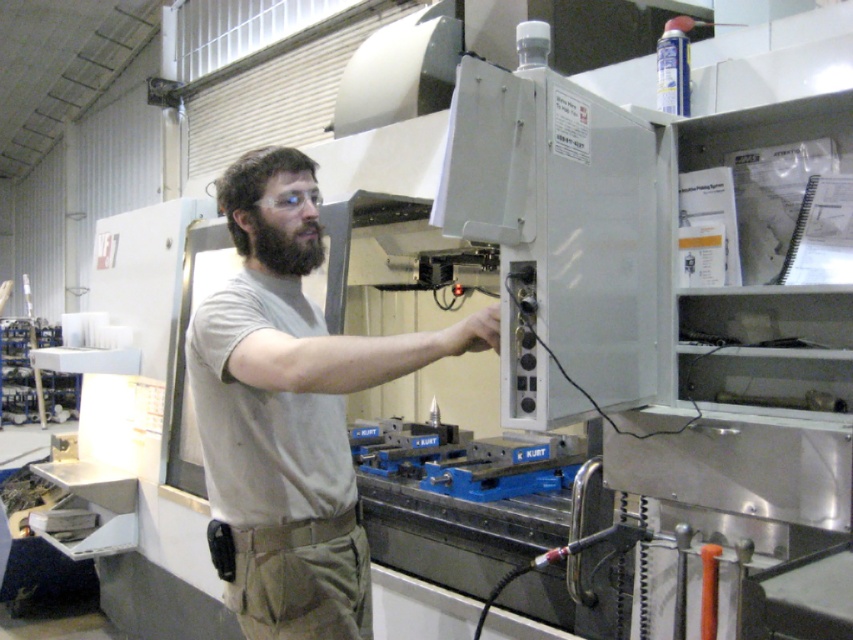
Question: Is light gray shirt at center below black fuzzy beard at center?

Choices:
 (A) yes
 (B) no

Answer: (A)

Question: Which object appears farthest from the camera in this image?

Choices:
 (A) black fuzzy beard at center
 (B) light gray shirt at center

Answer: (A)

Question: Where is light gray shirt at center located in relation to black fuzzy beard at center in the image?

Choices:
 (A) left
 (B) right

Answer: (B)

Question: Which point appears farthest from the camera in this image?

Choices:
 (A) (294, 168)
 (B) (309, 266)

Answer: (B)

Question: Does light gray shirt at center appear on the right side of black fuzzy beard at center?

Choices:
 (A) yes
 (B) no

Answer: (A)